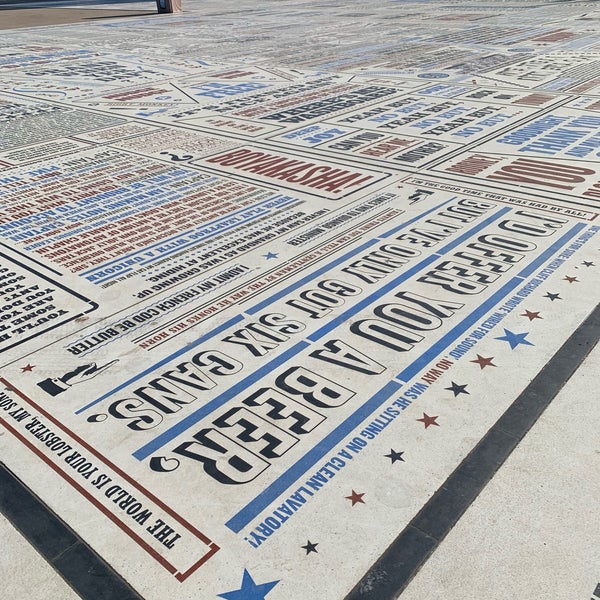
At what (x,y) coordinates should I click in order to perform the action: click on rug. Please return your answer as a coordinate pair (x, y). Looking at the image, I should click on (273, 432).